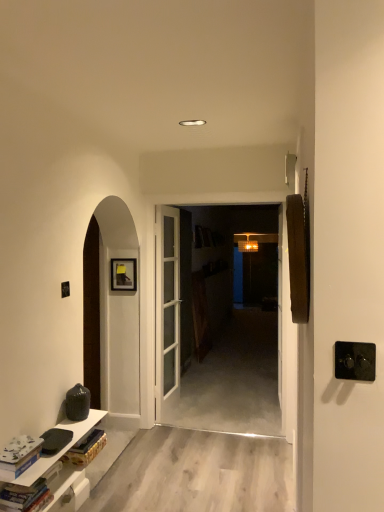
Question: Is black plastic door handle at right taller than hardcover book at lower left, which is counted as the first book, starting from the bottom?

Choices:
 (A) yes
 (B) no

Answer: (A)

Question: Would you say hardcover book at lower left, which is counted as the first book, starting from the bottom, is part of black plastic door handle at right's contents?

Choices:
 (A) no
 (B) yes

Answer: (A)

Question: Considering the relative sizes of black plastic door handle at right and hardcover book at lower left, which is the 2th book from top to bottom, in the image provided, is black plastic door handle at right bigger than hardcover book at lower left, which is the 2th book from top to bottom,?

Choices:
 (A) no
 (B) yes

Answer: (A)

Question: From the image's perspective, is black plastic door handle at right above hardcover book at lower left, which is the 2th book from top to bottom?

Choices:
 (A) no
 (B) yes

Answer: (B)

Question: From a real-world perspective, is black plastic door handle at right below hardcover book at lower left, which is counted as the first book, starting from the bottom?

Choices:
 (A) no
 (B) yes

Answer: (A)

Question: From a real-world perspective, is white glossy cabinet at lower left physically located above or below black plastic door handle at right?

Choices:
 (A) below
 (B) above

Answer: (A)

Question: Relative to black plastic door handle at right, is white glossy cabinet at lower left in front or behind?

Choices:
 (A) front
 (B) behind

Answer: (B)

Question: Would you say white glossy cabinet at lower left is inside or outside black plastic door handle at right?

Choices:
 (A) inside
 (B) outside

Answer: (B)

Question: In the image, is white glossy cabinet at lower left on the left side or the right side of black plastic door handle at right?

Choices:
 (A) left
 (B) right

Answer: (A)

Question: From the image's perspective, is black plastic door handle at right positioned above or below white glossy cabinet at lower left?

Choices:
 (A) below
 (B) above

Answer: (B)

Question: Which is correct: black plastic door handle at right is inside white glossy cabinet at lower left, or outside of it?

Choices:
 (A) inside
 (B) outside

Answer: (B)

Question: From a real-world perspective, is black plastic door handle at right above or below white glossy cabinet at lower left?

Choices:
 (A) above
 (B) below

Answer: (A)

Question: Based on their sizes in the image, would you say black plastic door handle at right is bigger or smaller than white glossy cabinet at lower left?

Choices:
 (A) small
 (B) big

Answer: (A)

Question: From the image's perspective, is black plastic door handle at right located above or below white matte book at lower left, which appears as the first book when viewed from the top?

Choices:
 (A) above
 (B) below

Answer: (A)

Question: Is point (337, 374) closer or farther from the camera than point (1, 463)?

Choices:
 (A) closer
 (B) farther

Answer: (A)